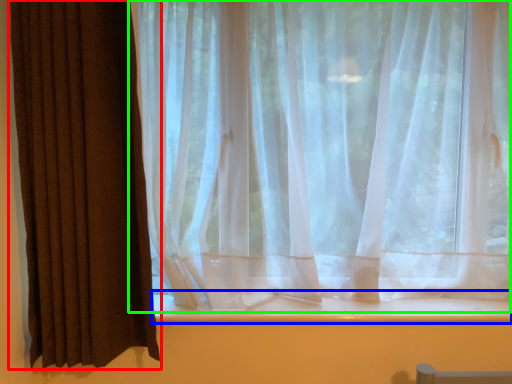
Question: Which object is the farthest from curtain (highlighted by a red box)? Choose among these: window sill (highlighted by a blue box) or curtain (highlighted by a green box).

Choices:
 (A) window sill
 (B) curtain

Answer: (A)